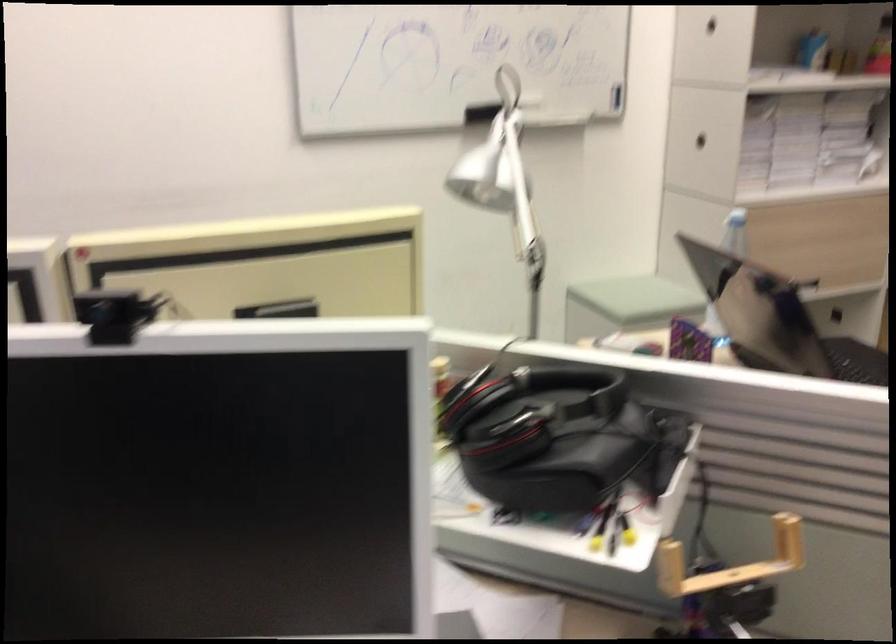
Image resolution: width=896 pixels, height=644 pixels. What do you see at coordinates (504, 183) in the screenshot? I see `a white lamp head` at bounding box center [504, 183].